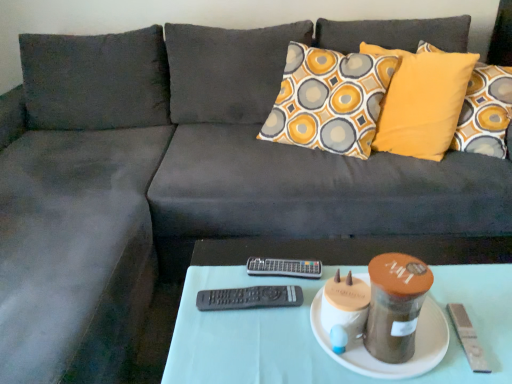
The height and width of the screenshot is (384, 512). What are the coordinates of `free location in front of black plastic remote at center, positioned as the first remote in top-to-bottom order` in the screenshot? It's located at (276, 330).